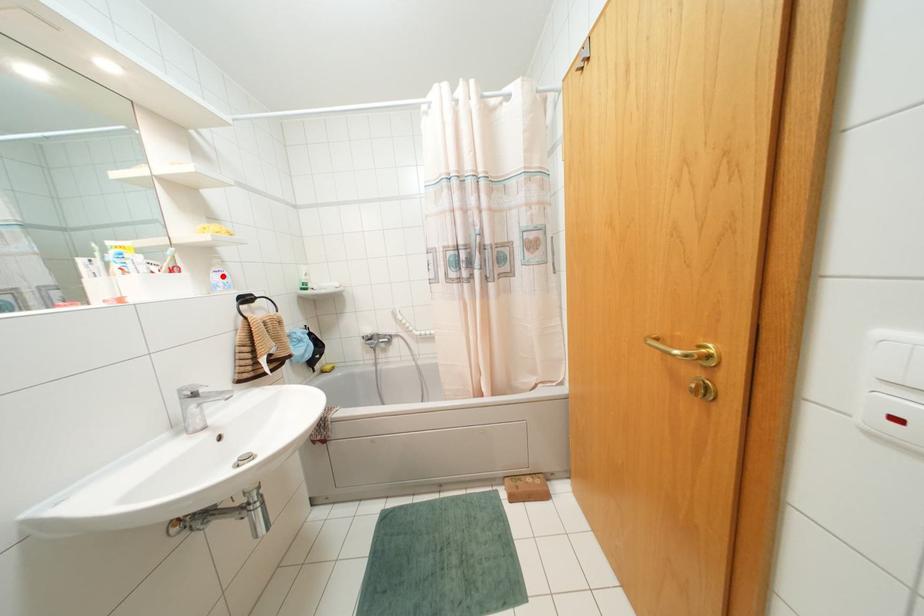
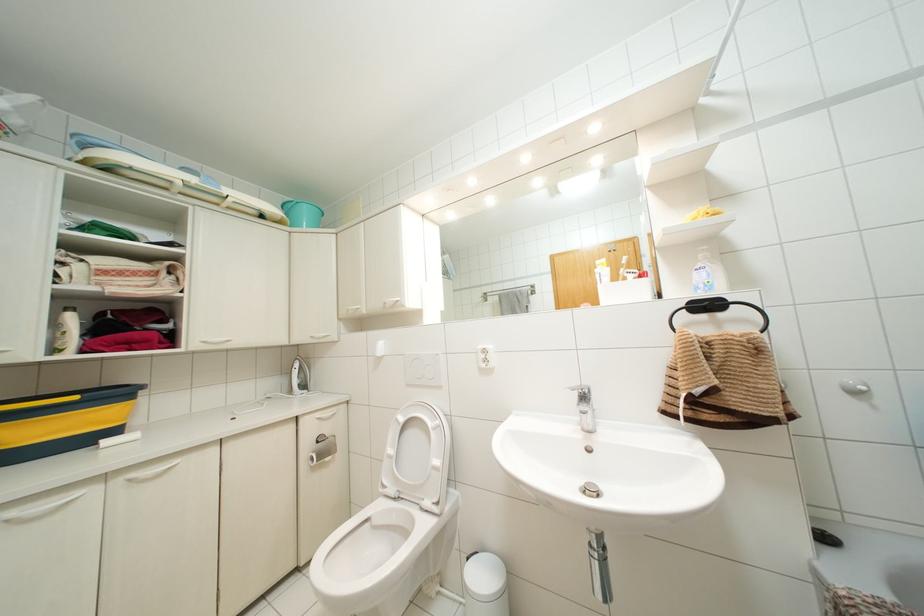
The point at the highlighted location is marked in the first image. Where is the corresponding point in the second image?

(703, 274)